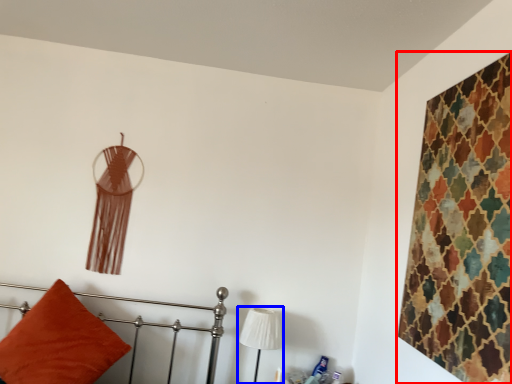
Question: Among these objects, which one is farthest to the camera, textile (highlighted by a red box) or table lamp (highlighted by a blue box)?

Choices:
 (A) textile
 (B) table lamp

Answer: (B)